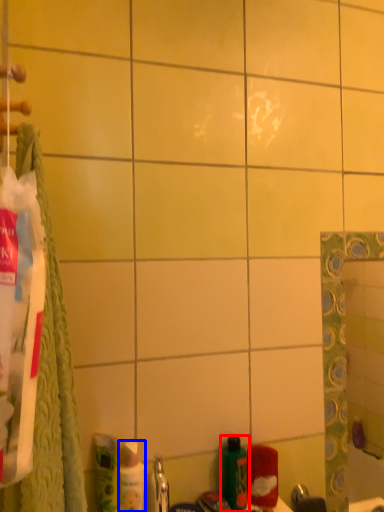
Question: Which point is further to the camera, bottle (highlighted by a red box) or mouthwash (highlighted by a blue box)?

Choices:
 (A) bottle
 (B) mouthwash

Answer: (A)